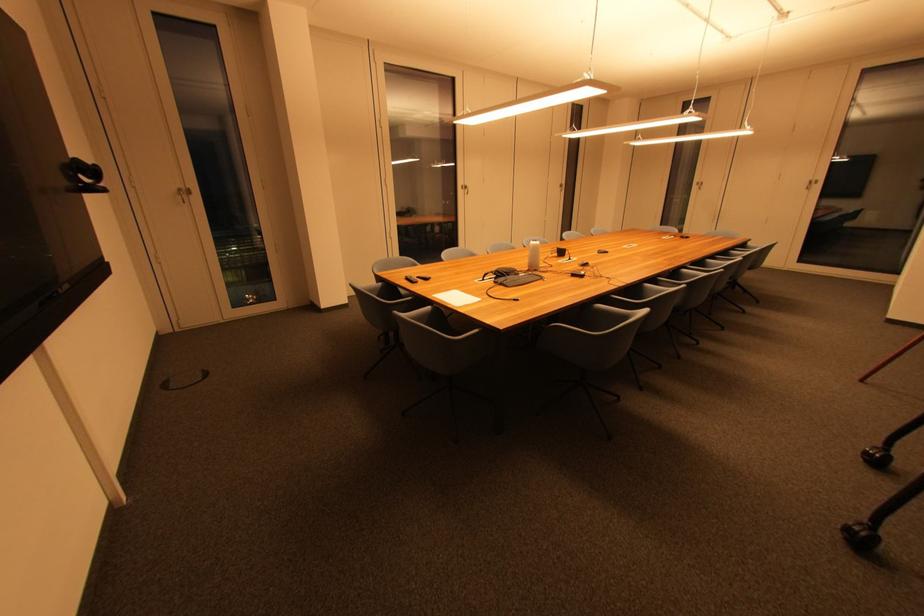
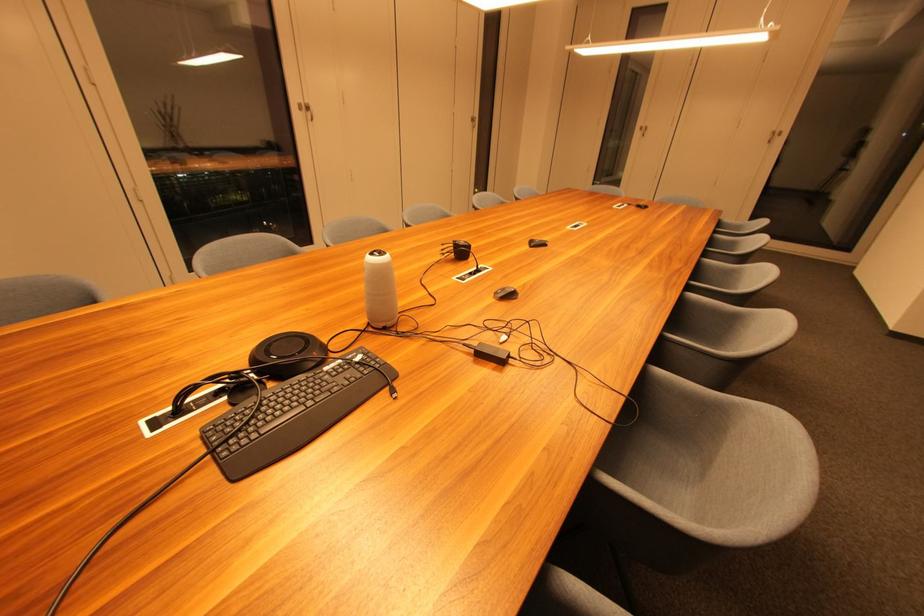
Locate, in the second image, the point that corresponds to (x=468, y=190) in the first image.

(306, 111)